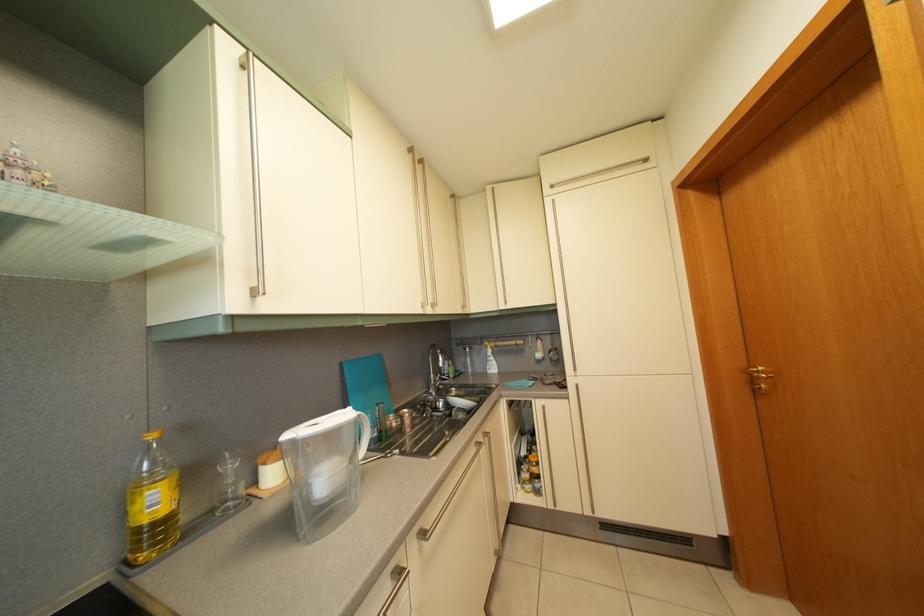
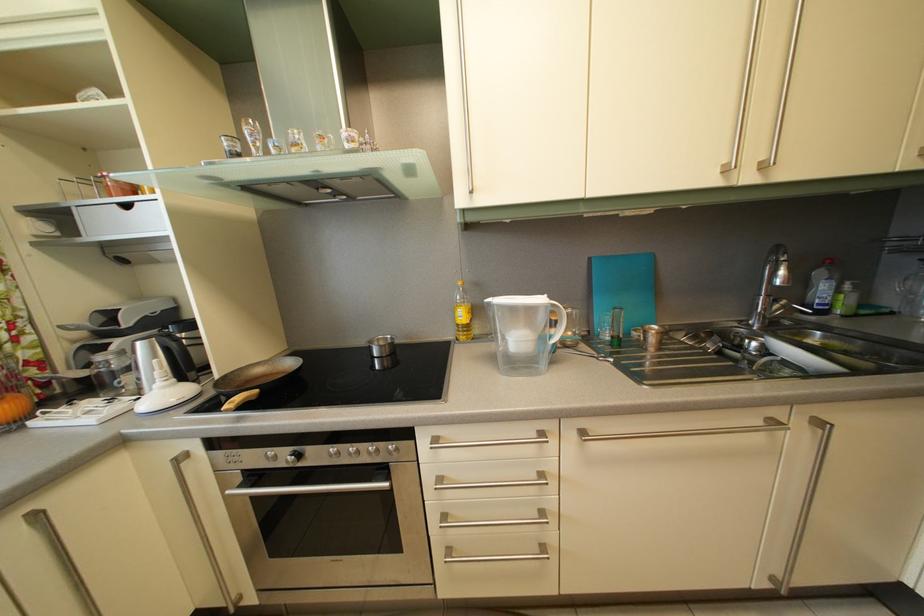
Based on the continuous images, in which direction is the camera rotating?

The camera's rotation is toward left-down.